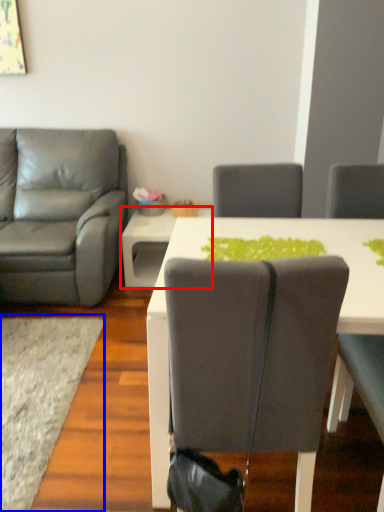
Question: Which point is closer to the camera, table (highlighted by a red box) or mat (highlighted by a blue box)?

Choices:
 (A) table
 (B) mat

Answer: (B)